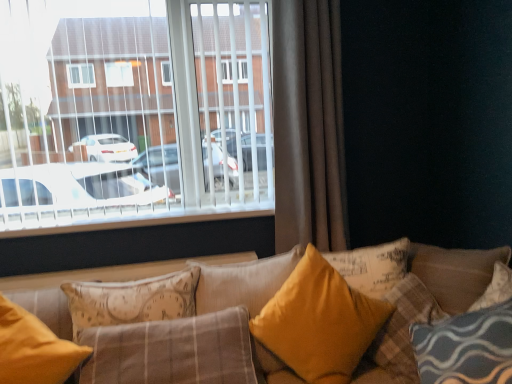
Question: Which direction should I rotate to look at yellow fabric pillow at center, which appears as the 2th pillow when viewed from the left?

Choices:
 (A) right
 (B) left

Answer: (B)

Question: Is yellow fabric pillow at center, which is the first pillow in right-to-left order, closer to the viewer compared to yellow fabric pillow at center, which is the 4th pillow from right to left?

Choices:
 (A) yes
 (B) no

Answer: (A)

Question: From the image's perspective, is yellow fabric pillow at center, placed as the 5th pillow when sorted from left to right, over yellow fabric pillow at center, which is the 4th pillow from right to left?

Choices:
 (A) no
 (B) yes

Answer: (A)

Question: From the image's perspective, does yellow fabric pillow at center, placed as the 5th pillow when sorted from left to right, appear lower than yellow fabric pillow at center, which is the 4th pillow from right to left?

Choices:
 (A) no
 (B) yes

Answer: (B)

Question: Is yellow fabric pillow at center, which appears as the 2th pillow when viewed from the left, surrounded by yellow fabric pillow at center, placed as the 5th pillow when sorted from left to right?

Choices:
 (A) no
 (B) yes

Answer: (A)

Question: Can you confirm if yellow fabric pillow at center, placed as the 5th pillow when sorted from left to right, is wider than yellow fabric pillow at center, which is the 4th pillow from right to left?

Choices:
 (A) yes
 (B) no

Answer: (A)

Question: Is yellow fabric pillow at center, placed as the 5th pillow when sorted from left to right, shorter than yellow fabric pillow at center, which is the 4th pillow from right to left?

Choices:
 (A) yes
 (B) no

Answer: (A)

Question: Considering the relative positions of white plastic blinds at upper left and yellow fabric pillow at center, which is the 4th pillow from right to left, in the image provided, is white plastic blinds at upper left to the left of yellow fabric pillow at center, which is the 4th pillow from right to left, from the viewer's perspective?

Choices:
 (A) no
 (B) yes

Answer: (B)

Question: From a real-world perspective, is white plastic blinds at upper left on yellow fabric pillow at center, which appears as the 2th pillow when viewed from the left?

Choices:
 (A) yes
 (B) no

Answer: (A)

Question: Considering the relative sizes of white plastic blinds at upper left and yellow fabric pillow at center, which is the 4th pillow from right to left, in the image provided, is white plastic blinds at upper left shorter than yellow fabric pillow at center, which is the 4th pillow from right to left,?

Choices:
 (A) yes
 (B) no

Answer: (B)

Question: Is white plastic blinds at upper left positioned far away from yellow fabric pillow at center, which appears as the 2th pillow when viewed from the left?

Choices:
 (A) no
 (B) yes

Answer: (A)

Question: Considering the relative sizes of white plastic blinds at upper left and yellow fabric pillow at center, which is the 4th pillow from right to left, in the image provided, is white plastic blinds at upper left bigger than yellow fabric pillow at center, which is the 4th pillow from right to left,?

Choices:
 (A) yes
 (B) no

Answer: (A)

Question: Considering the relative sizes of white plastic blinds at upper left and yellow fabric pillow at center, which is the 4th pillow from right to left, in the image provided, is white plastic blinds at upper left wider than yellow fabric pillow at center, which is the 4th pillow from right to left,?

Choices:
 (A) yes
 (B) no

Answer: (B)

Question: Can matte yellow pillow at lower left, which appears as the first pillow when viewed from the left, be found inside white plastic blinds at upper left?

Choices:
 (A) no
 (B) yes

Answer: (A)